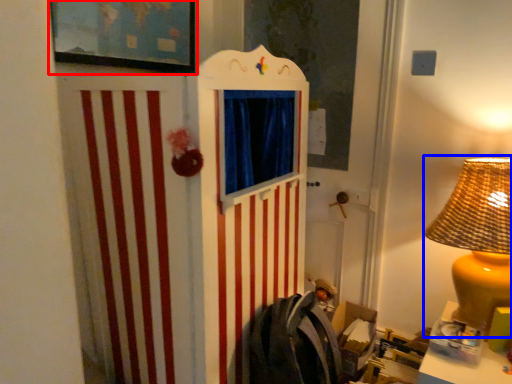
Question: Which point is further to the camera, picture frame (highlighted by a red box) or table lamp (highlighted by a blue box)?

Choices:
 (A) picture frame
 (B) table lamp

Answer: (A)